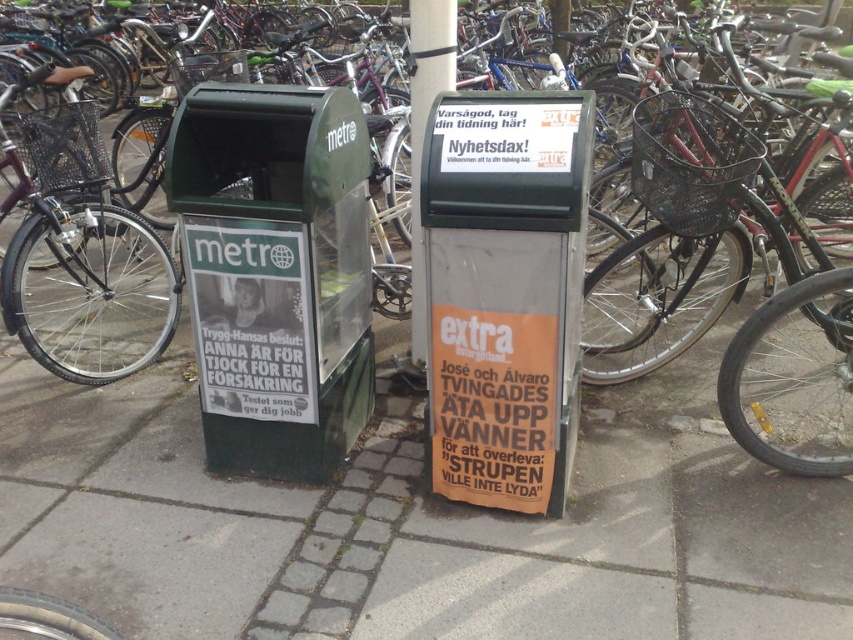
Can you confirm if black wire basket at right is taller than shiny black bicycle at left?

In fact, black wire basket at right may be shorter than shiny black bicycle at left.

Does black wire basket at right appear on the left side of shiny black bicycle at left?

In fact, black wire basket at right is to the right of shiny black bicycle at left.

Is point (648, 278) less distant than point (30, 172)?

Yes, point (648, 278) is closer to viewer.

At what (x,y) coordinates should I click in order to perform the action: click on black wire basket at right. Please return your answer as a coordinate pair (x, y). Looking at the image, I should click on (686, 236).

Does shiny black bicycle at left have a greater height compared to metallic gray pole at center?

Correct, shiny black bicycle at left is much taller as metallic gray pole at center.

Does shiny black bicycle at left appear under metallic gray pole at center?

Incorrect, shiny black bicycle at left is not positioned below metallic gray pole at center.

Which is in front, point (57, 314) or point (410, 83)?

Positioned in front is point (410, 83).

Find the location of a particular element. The image size is (853, 640). shiny black bicycle at left is located at coordinates (80, 256).

Is black wire basket at right smaller than metallic gray pole at center?

No.

Is black wire basket at right thinner than metallic gray pole at center?

Incorrect, black wire basket at right's width is not less than metallic gray pole at center's.

Between point (735, 205) and point (445, 35), which one is positioned in front?

Point (735, 205)

At what (x,y) coordinates should I click in order to perform the action: click on black wire basket at right. Please return your answer as a coordinate pair (x, y). The height and width of the screenshot is (640, 853). Looking at the image, I should click on (686, 236).